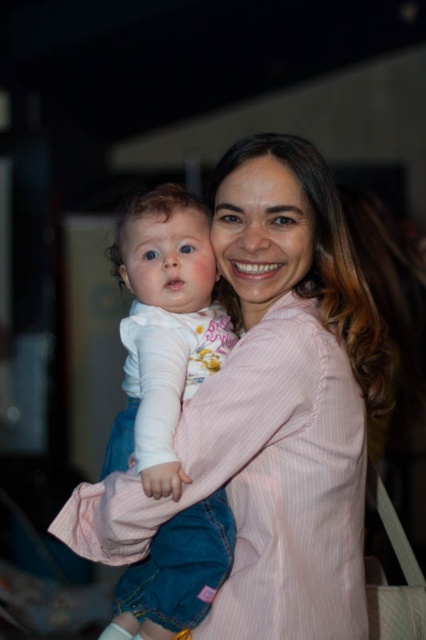
Question: Is pink striped shirt at center bigger than white soft fabric baby at center?

Choices:
 (A) yes
 (B) no

Answer: (A)

Question: Which of the following is the closest to the observer?

Choices:
 (A) white soft fabric baby at center
 (B) pink striped shirt at center

Answer: (A)

Question: Which object is closer to the camera taking this photo?

Choices:
 (A) pink striped shirt at center
 (B) white soft fabric baby at center

Answer: (B)

Question: Does pink striped shirt at center lie in front of white soft fabric baby at center?

Choices:
 (A) yes
 (B) no

Answer: (B)

Question: Is pink striped shirt at center closer to camera compared to white soft fabric baby at center?

Choices:
 (A) no
 (B) yes

Answer: (A)